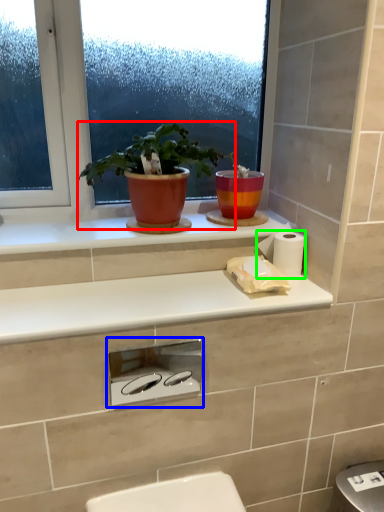
Question: Which is farther away from houseplant (highlighted by a red box)? appliance (highlighted by a blue box) or toilet paper (highlighted by a green box)?

Choices:
 (A) appliance
 (B) toilet paper

Answer: (A)